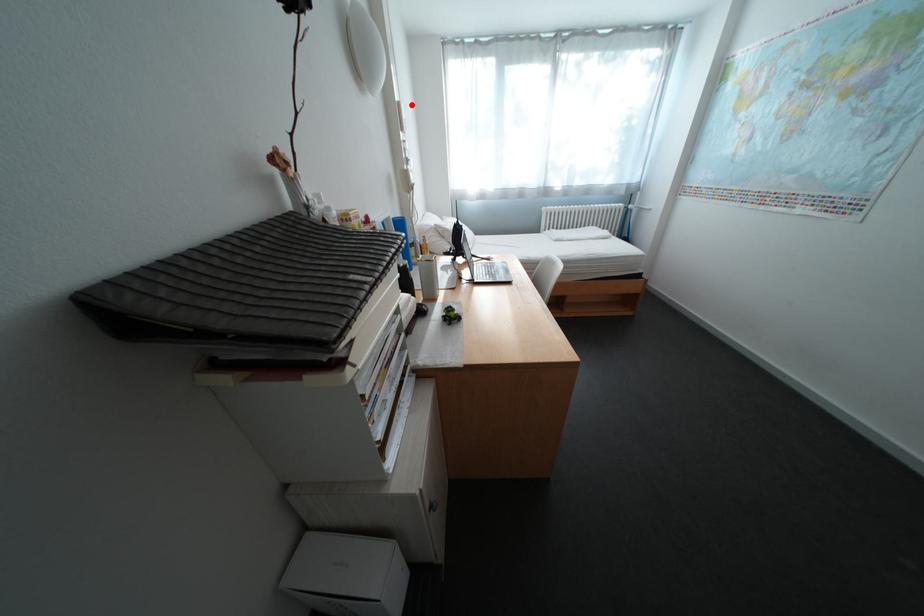
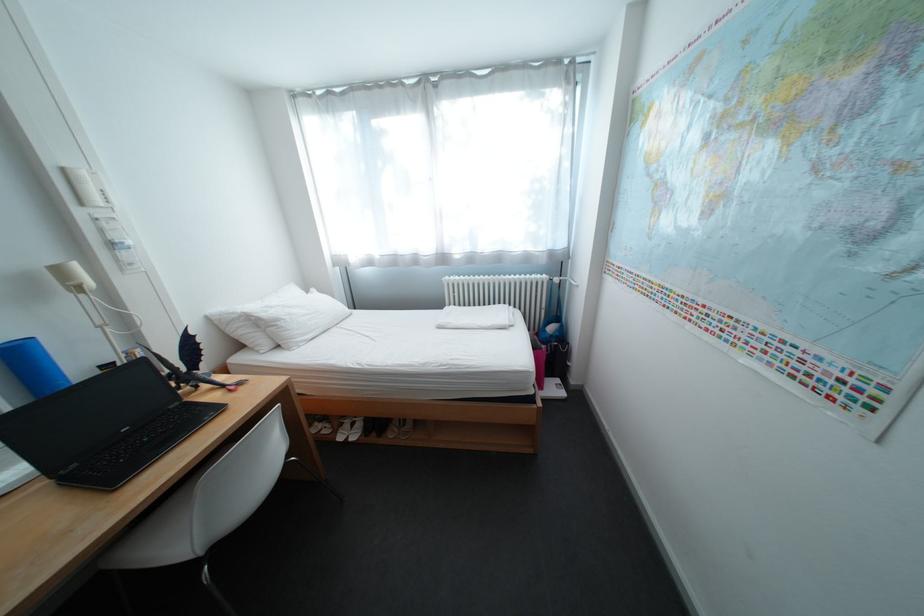
Where in the second image is the point corresponding to the highlighted location from the first image?

(76, 171)